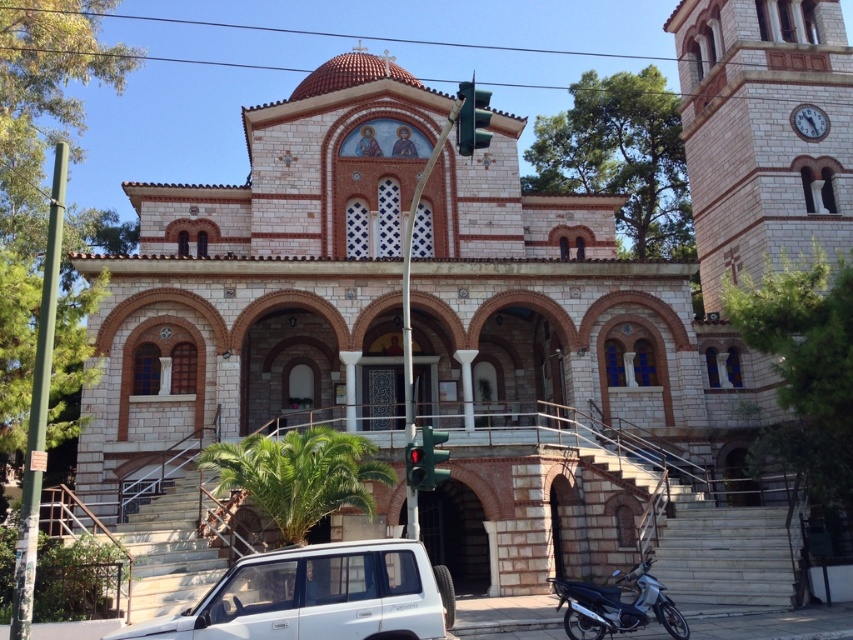
You are driving a car that is 4.5 meters long. You need to park your car between the white matte suv at lower center and the green glass traffic light at center. Is there enough space between them for your car?

The white matte suv at lower center is 20.70 meters from the green glass traffic light at center. Since your car is only 4.5 meters long, there is sufficient space between them to park your car.

You are a pedestrian standing at the side of the road near the church. You see the white matte suv at lower center and the green glass traffic light at center. Which vehicle is closer to the traffic light?

The white matte suv at lower center is positioned on the left side of the green glass traffic light at center, so the white matte suv at lower center is closer to the traffic light.